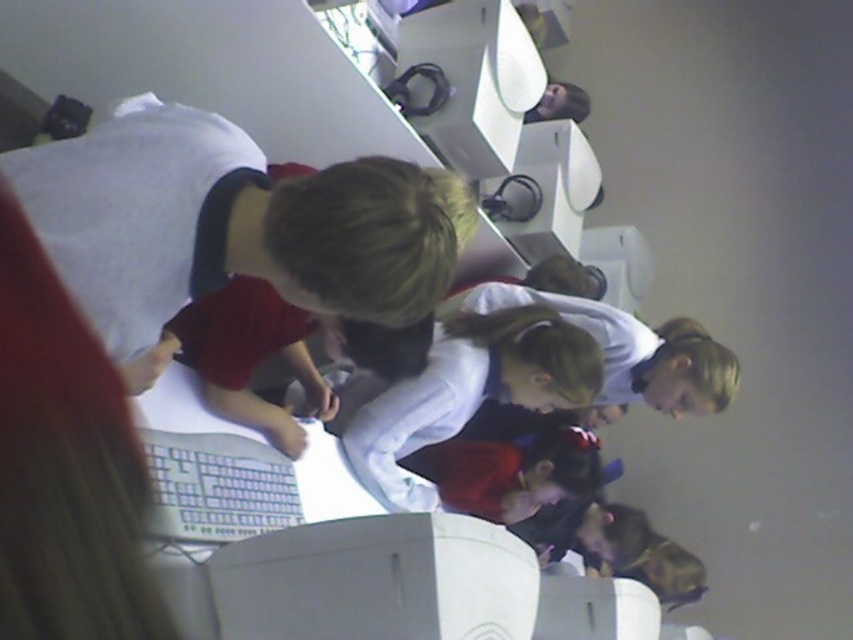
You are standing behind the computer workstation and want to hand a document to the person wearing the matte red shirt at center and the person wearing the white matte shirt at center. Which person is closer to you?

The matte red shirt at center is in front of the white matte shirt at center, so the white matte shirt at center is closer to you.

You are standing in front of the computer workstation in the rotated image. There are two points marked on the desk surface. The first point is at coordinates point (421, 636) and the second point is at point (448, 492). Which point is closer to you?

Point (421, 636) is closer to the viewer than point (448, 492).